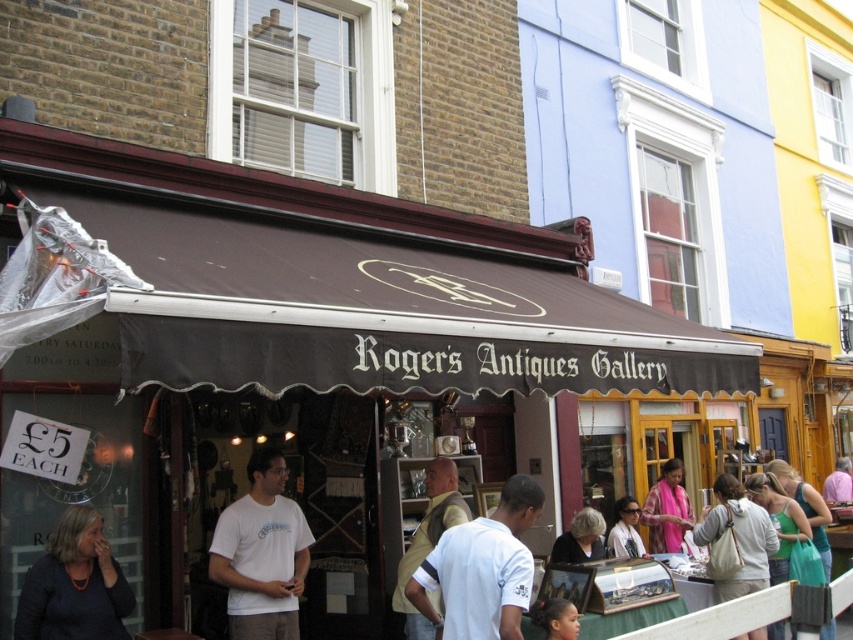
Question: Which point appears farthest from the camera in this image?

Choices:
 (A) [x=635, y=500]
 (B) [x=538, y=502]

Answer: (A)

Question: Can you confirm if white cotton t-shirt at center is positioned to the left of matte white shirt at center?

Choices:
 (A) yes
 (B) no

Answer: (A)

Question: Is beige fabric vest at center to the right of smooth brown hair at lower center from the viewer's perspective?

Choices:
 (A) no
 (B) yes

Answer: (A)

Question: Which object is positioned closest to the smooth brown hair at lower center?

Choices:
 (A) pink fabric shirt at center
 (B) white cotton hoodie at lower right

Answer: (B)

Question: Which of these objects is positioned closest to the white cotton t-shirt at center?

Choices:
 (A) pink fabric scarf at center
 (B) white cotton shirt at center

Answer: (B)

Question: Is dark blue sweater at lower left below smooth brown hair at lower center?

Choices:
 (A) yes
 (B) no

Answer: (B)